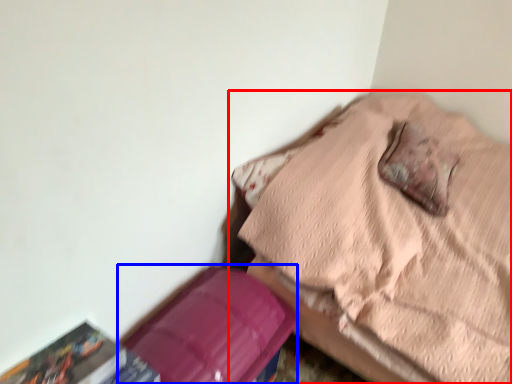
Question: Which of the following is the closest to the observer, furniture (highlighted by a red box) or cardboard box (highlighted by a blue box)?

Choices:
 (A) furniture
 (B) cardboard box

Answer: (A)